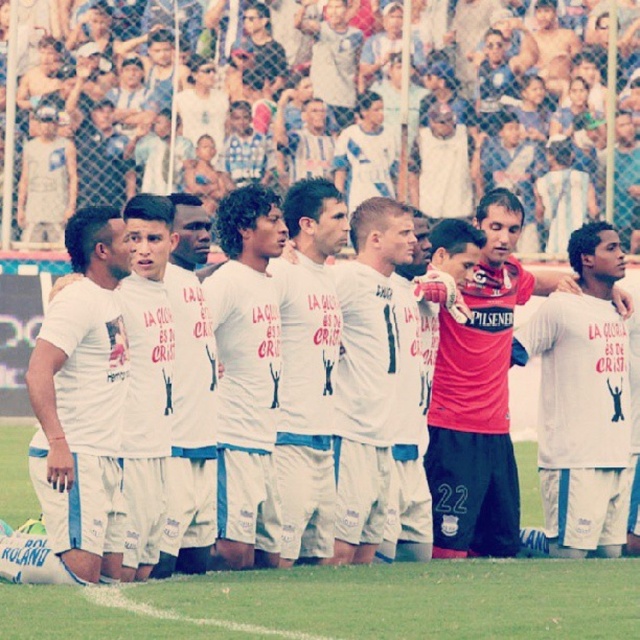
Question: Among these objects, which one is farthest from the camera?

Choices:
 (A) white matte jersey at center
 (B) white cotton t-shirt at center
 (C) white cotton shirt at center
 (D) white fabric grass at center

Answer: (C)

Question: Which point is closer to the camera taking this photo?

Choices:
 (A) (260, 589)
 (B) (588, 490)
 (C) (134, 224)
 (D) (104, 376)

Answer: (A)

Question: Does white cotton t-shirt at center have a larger size compared to white cotton shirt at center?

Choices:
 (A) no
 (B) yes

Answer: (B)

Question: Estimate the real-world distances between objects in this image. Which object is farther from the white cotton t-shirt at center?

Choices:
 (A) white cotton shirt at center
 (B) white fabric grass at center
 (C) white matte jersey at center

Answer: (C)

Question: In this image, where is white cotton t-shirt at center located relative to white cotton shirt at center?

Choices:
 (A) left
 (B) right

Answer: (A)

Question: Is white fabric grass at center closer to camera compared to white matte jersey at center?

Choices:
 (A) no
 (B) yes

Answer: (B)